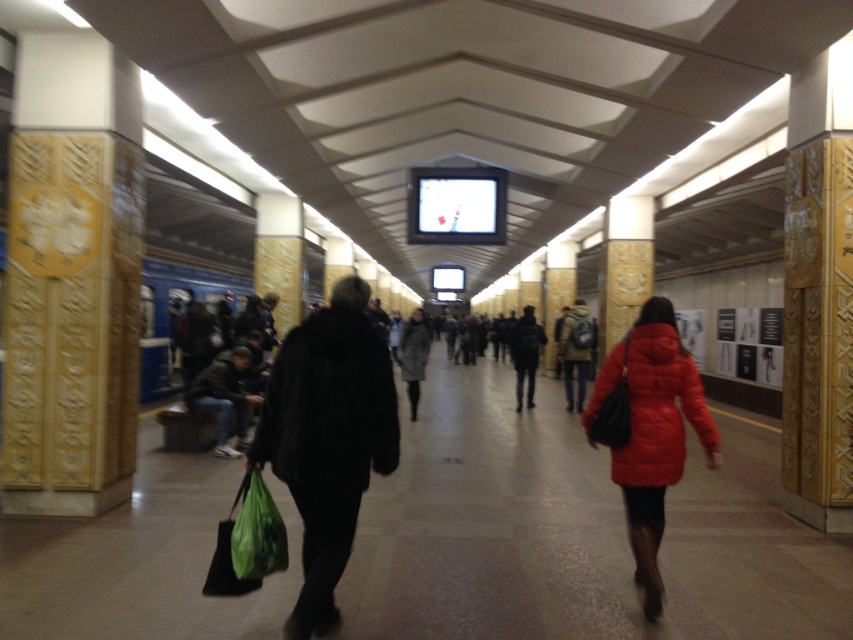
You are standing on the subway platform and notice both the black fur coat at center and the matte black backpack at center. Which object is positioned to the left when viewed from your perspective?

The black fur coat at center is to the left of the matte black backpack at center, so it is positioned to the left.

You are a subway passenger carrying a large briefcase and need to find space to stand between the black fur coat at center and the gray wool coat at center. Which coat should you position yourself closer to if you want to maximize your available standing space?

The gray wool coat at center is wider than the black fur coat at center, so positioning yourself closer to the black fur coat at center will provide more space for your briefcase.

In the scene shown: You are a commuter trying to find a spot to sit on the subway platform. You see a matte black backpack at center and a gray wool coat at center. Which item is taking up more space and would require moving to make room?

The gray wool coat at center occupies more space than the matte black backpack at center, so moving it would be necessary to create more room.